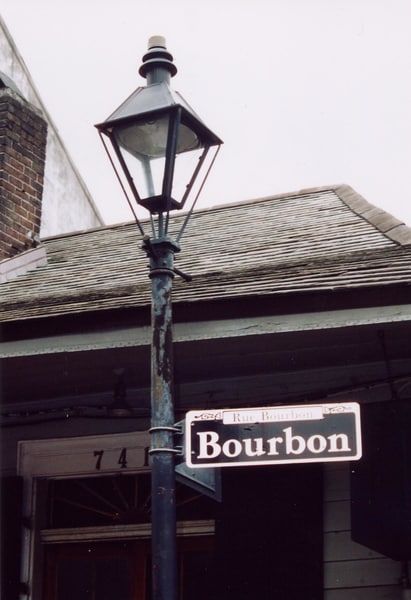
Identify the location of chimney. (29, 147).